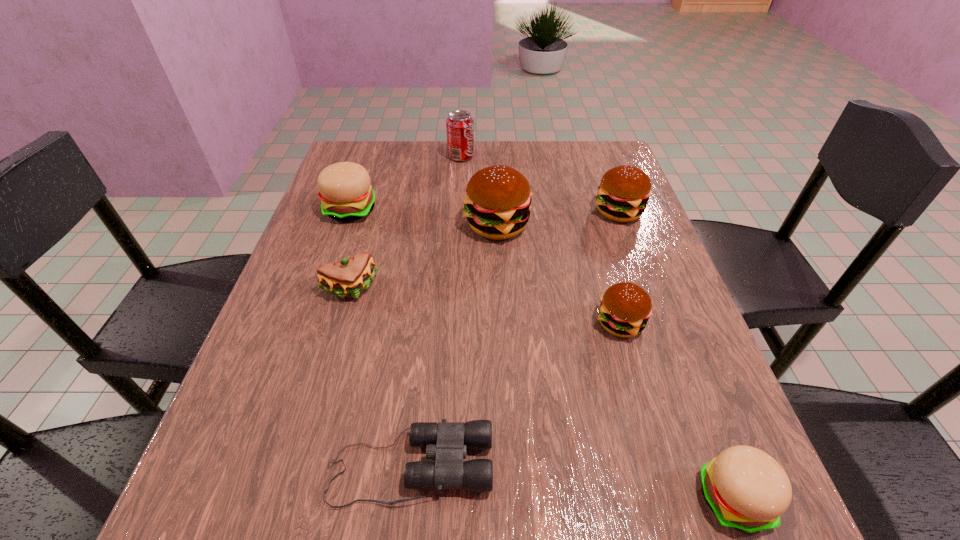
Identify the location of vacant space that satisfies the following two spatial constraints: 1. on the front side of the farthest object; 2. on the left side of the nearer beige hamburger. This screenshot has width=960, height=540. (441, 497).

Locate an element on the screen. Image resolution: width=960 pixels, height=540 pixels. free space that satisfies the following two spatial constraints: 1. on the front side of the second smallest brown hamburger; 2. at the eyepiece of the binoculars is located at coordinates (712, 466).